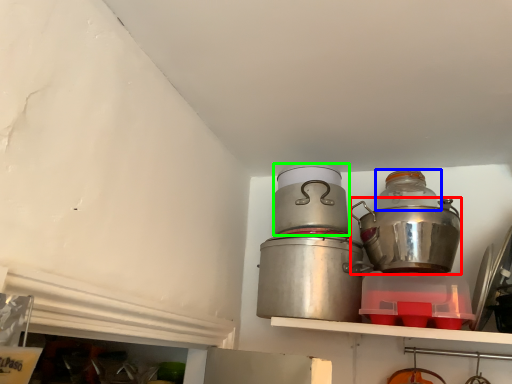
Question: Which is farther away from crock pot (highlighted by a red box)? bottle (highlighted by a blue box) or appliance (highlighted by a green box)?

Choices:
 (A) bottle
 (B) appliance

Answer: (B)